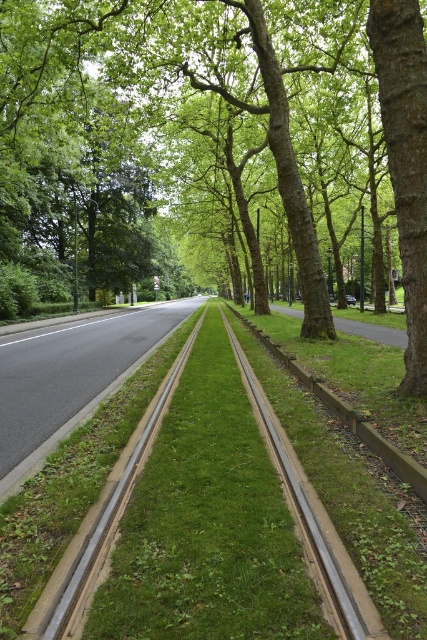
Question: Observing the image, what is the correct spatial positioning of green leafy tree at center in reference to brown rough bark tree at right?

Choices:
 (A) left
 (B) right

Answer: (B)

Question: Based on their relative distances, which object is farther from the green leafy tree at center?

Choices:
 (A) metallic silver train track at center
 (B) brown rough bark tree at right

Answer: (B)

Question: Is brown rough bark tree at right to the right of metallic silver train track at center from the viewer's perspective?

Choices:
 (A) yes
 (B) no

Answer: (A)

Question: Based on their relative distances, which object is farther from the metallic silver train track at center?

Choices:
 (A) green leafy tree at center
 (B) brown rough bark tree at right

Answer: (A)

Question: Among these objects, which one is nearest to the camera?

Choices:
 (A) brown rough bark tree at right
 (B) metallic silver train track at center
 (C) green leafy tree at center

Answer: (B)

Question: Is brown rough bark tree at right further to the viewer compared to metallic silver train track at center?

Choices:
 (A) no
 (B) yes

Answer: (B)